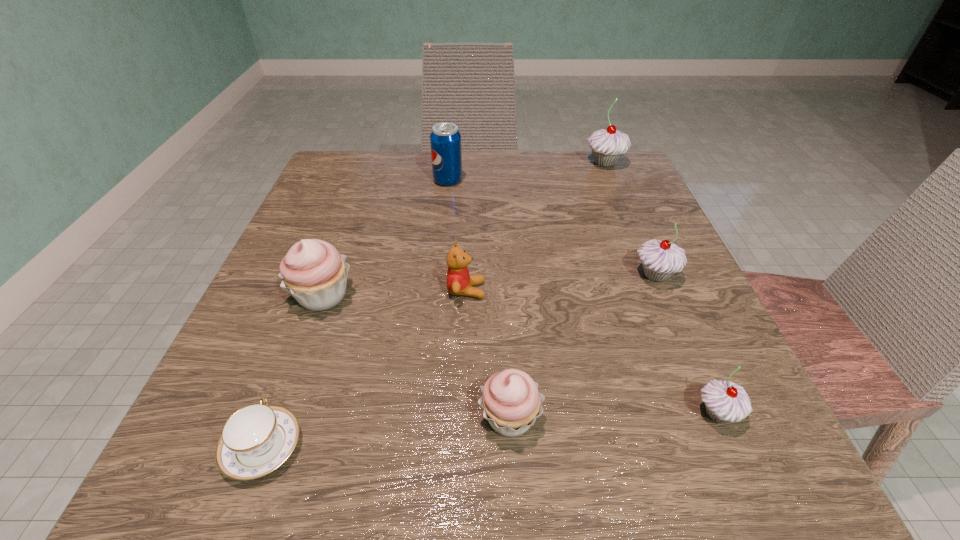
This screenshot has width=960, height=540. Find the location of `free space located on the side with the handle of the shortest object`. free space located on the side with the handle of the shortest object is located at coordinates (290, 373).

I want to click on vacant point located 0.250m on the side with the handle of the shortest object, so click(324, 281).

This screenshot has width=960, height=540. I want to click on cupcake that is at the far edge, so click(607, 146).

Locate an element on the screen. This screenshot has height=540, width=960. pop soda present at the far edge is located at coordinates (445, 139).

Where is `teacup positioned at the near edge`? The width and height of the screenshot is (960, 540). teacup positioned at the near edge is located at coordinates (258, 438).

Where is `cupcake situated at the left edge`? This screenshot has width=960, height=540. cupcake situated at the left edge is located at coordinates (313, 272).

Locate an element on the screen. This screenshot has width=960, height=540. teacup that is at the left edge is located at coordinates (258, 438).

This screenshot has width=960, height=540. What are the coordinates of `object positioned at the near left corner` in the screenshot? It's located at (258, 438).

Identify the location of object that is at the far right corner. (607, 146).

The width and height of the screenshot is (960, 540). What are the coordinates of `object that is positioned at the near right corner` in the screenshot? It's located at (724, 401).